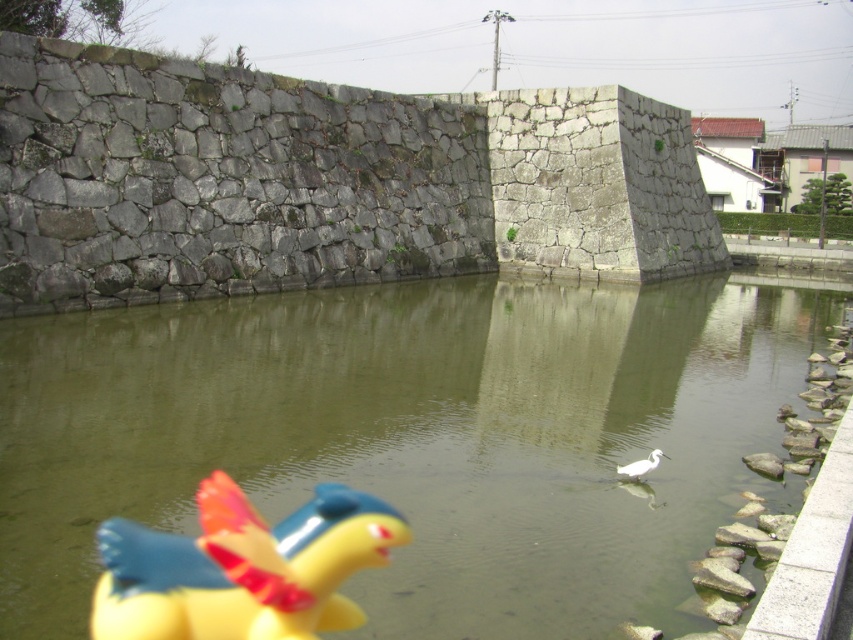
Who is shorter, greenish water at center or white matte bird at center?

white matte bird at center is shorter.

Does point (546, 369) come in front of point (619, 474)?

No, (546, 369) is further to viewer.

Find the location of a particular element. greenish water at center is located at coordinates (415, 438).

Can you confirm if greenish water at center is positioned to the left of yellow rubber duck at lower left?

No, greenish water at center is not to the left of yellow rubber duck at lower left.

Is greenish water at center below yellow rubber duck at lower left?

No, greenish water at center is not below yellow rubber duck at lower left.

The height and width of the screenshot is (640, 853). Describe the element at coordinates (415, 438) in the screenshot. I see `greenish water at center` at that location.

The height and width of the screenshot is (640, 853). I want to click on greenish water at center, so click(415, 438).

Which of these two, yellow rubber duck at lower left or white matte bird at center, stands shorter?

white matte bird at center

Between yellow rubber duck at lower left and white matte bird at center, which one has more height?

With more height is yellow rubber duck at lower left.

Find the location of a particular element. yellow rubber duck at lower left is located at coordinates (242, 566).

Where is `yellow rubber duck at lower left`? This screenshot has width=853, height=640. yellow rubber duck at lower left is located at coordinates (242, 566).